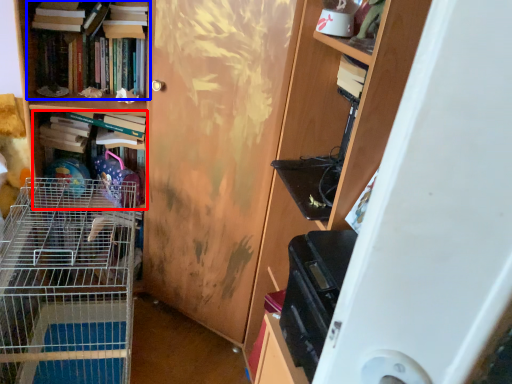
Question: Which of the following is the farthest to the observer, book (highlighted by a red box) or book (highlighted by a blue box)?

Choices:
 (A) book
 (B) book

Answer: (A)